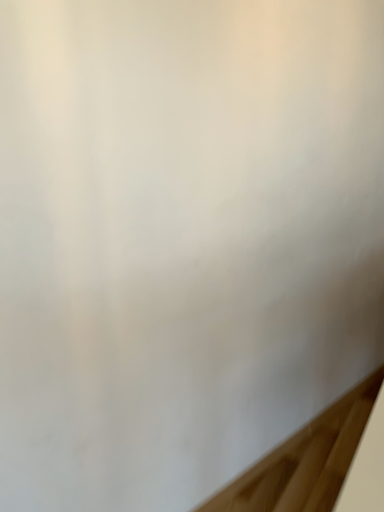
Find the location of `wooden panel at bottom right`. wooden panel at bottom right is located at coordinates (305, 461).

What is the approximate height of wooden panel at bottom right?

wooden panel at bottom right is 1.96 inches tall.

The height and width of the screenshot is (512, 384). Describe the element at coordinates (305, 461) in the screenshot. I see `wooden panel at bottom right` at that location.

The height and width of the screenshot is (512, 384). What are the coordinates of `wooden panel at bottom right` in the screenshot? It's located at (305, 461).